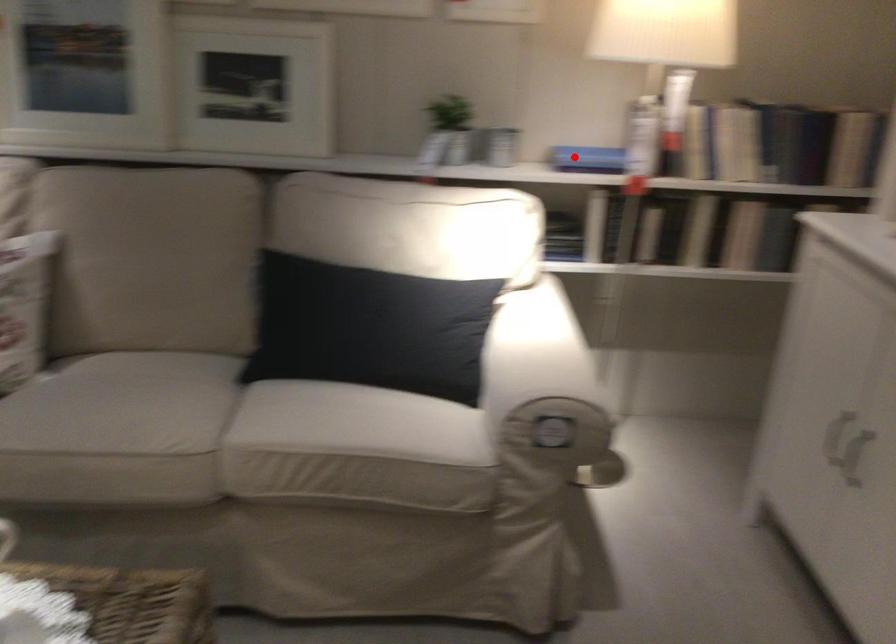
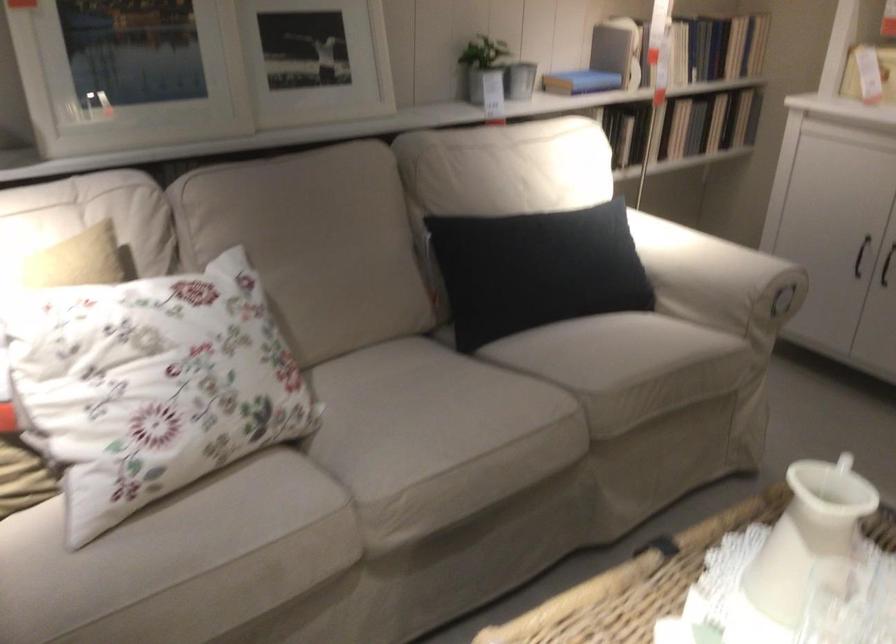
Find the pixel in the second image that matches the highlighted location in the first image.

(580, 82)